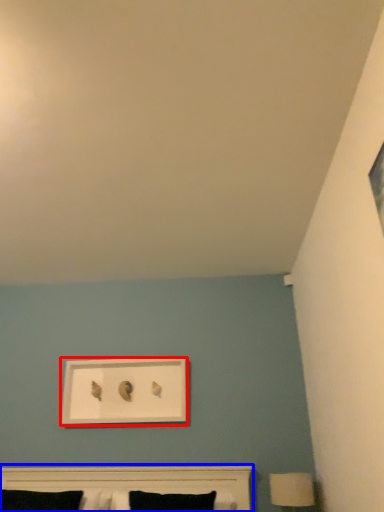
Question: Which object is further to the camera taking this photo, picture frame (highlighted by a red box) or bed (highlighted by a blue box)?

Choices:
 (A) picture frame
 (B) bed

Answer: (A)